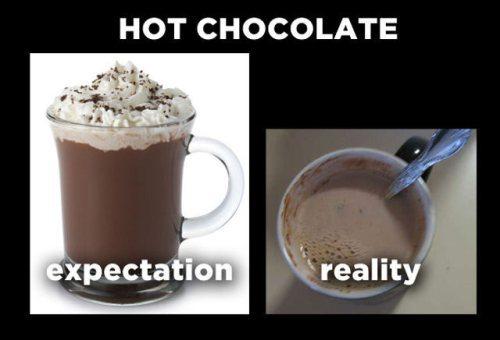
You are a GUI agent. You are given a task and a screenshot of the screen. Output one action in this format:
    pyautogui.click(x=<x>, y=<y>)
    Task: Click on the spoon handle
    The height and width of the screenshot is (340, 500).
    Given the screenshot: What is the action you would take?
    pyautogui.click(x=442, y=149)